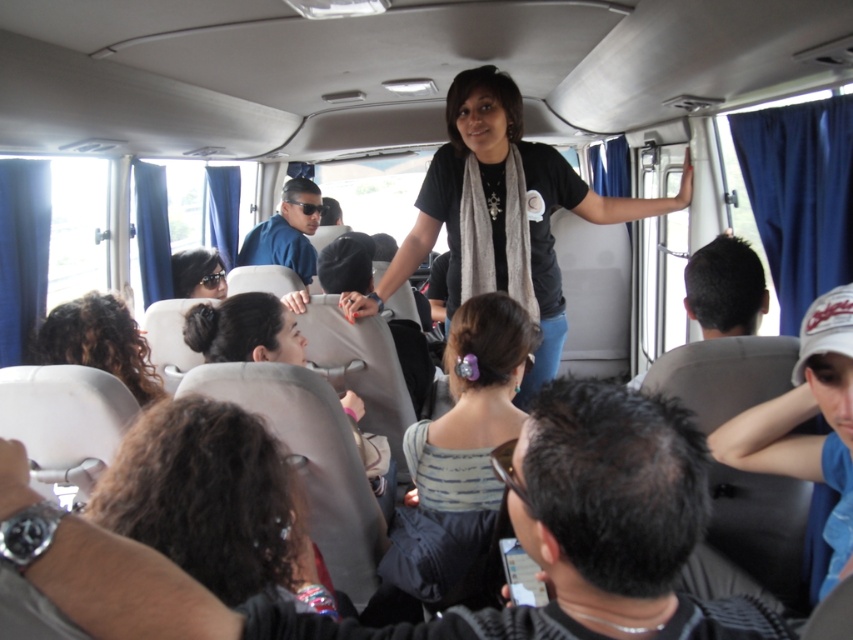
Is blue fabric cap at right above matte gray hair at center?

Incorrect, blue fabric cap at right is not positioned above matte gray hair at center.

Which is below, blue fabric cap at right or matte gray hair at center?

Positioned lower is blue fabric cap at right.

Who is more forward, (782, 410) or (387, 508)?

Positioned in front is point (782, 410).

Where is `blue fabric cap at right`? blue fabric cap at right is located at coordinates (805, 419).

Who is more distant from viewer, (825,328) or (688,269)?

Point (688,269)

Is blue fabric cap at right taller than dark brown hair at upper right?

Yes, blue fabric cap at right is taller than dark brown hair at upper right.

Describe the element at coordinates (805, 419) in the screenshot. This screenshot has height=640, width=853. I see `blue fabric cap at right` at that location.

Find the location of a particular element. Image resolution: width=853 pixels, height=640 pixels. blue fabric cap at right is located at coordinates (805, 419).

Consider the image. Who is positioned more to the left, dark brown hair at upper right or matte black sunglasses at lower left?

Positioned to the left is matte black sunglasses at lower left.

Is dark brown hair at upper right positioned in front of matte black sunglasses at lower left?

Yes, it is.

Between point (730, 259) and point (180, 273), which one is positioned in front?

Point (730, 259)

You are a GUI agent. You are given a task and a screenshot of the screen. Output one action in this format:
    pyautogui.click(x=<x>, y=<y>)
    Task: Click on the dark brown hair at upper right
    Image resolution: width=853 pixels, height=640 pixels.
    Given the screenshot: What is the action you would take?
    pyautogui.click(x=724, y=288)